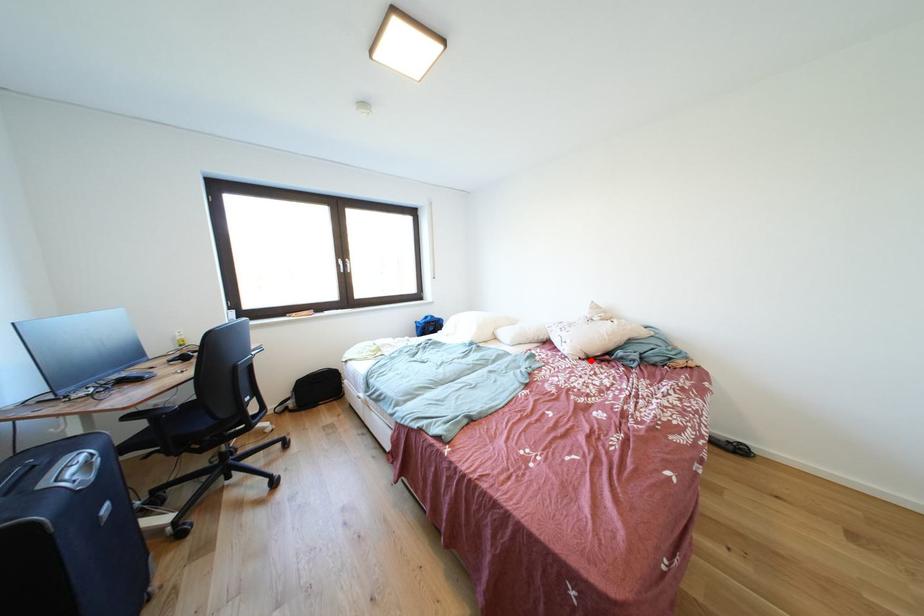
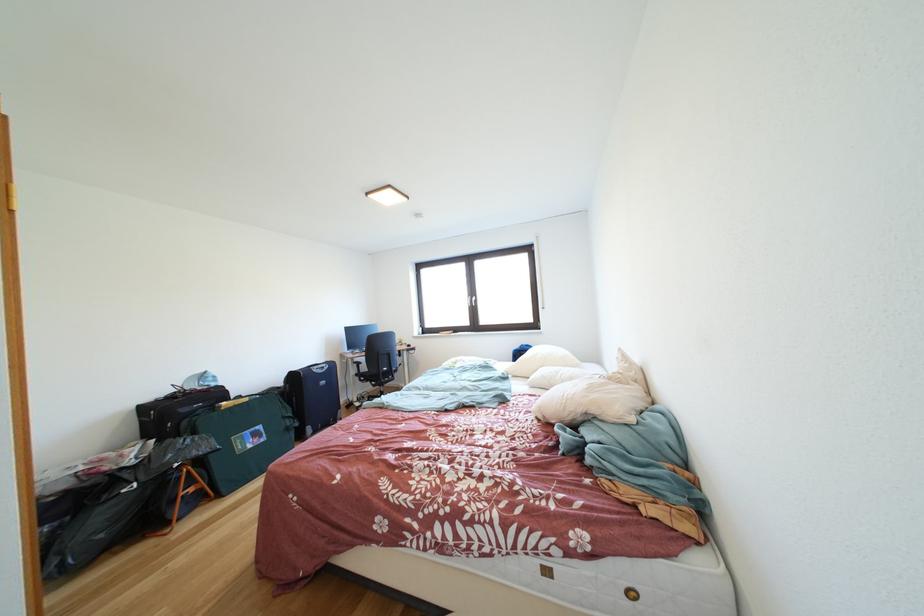
The point at the highlighted location is marked in the first image. Where is the corresponding point in the second image?

(549, 421)